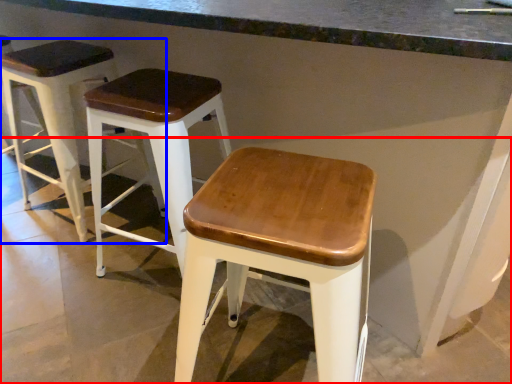
Question: Which of the following is the closest to the observer, concrete (highlighted by a red box) or stool (highlighted by a blue box)?

Choices:
 (A) concrete
 (B) stool

Answer: (A)